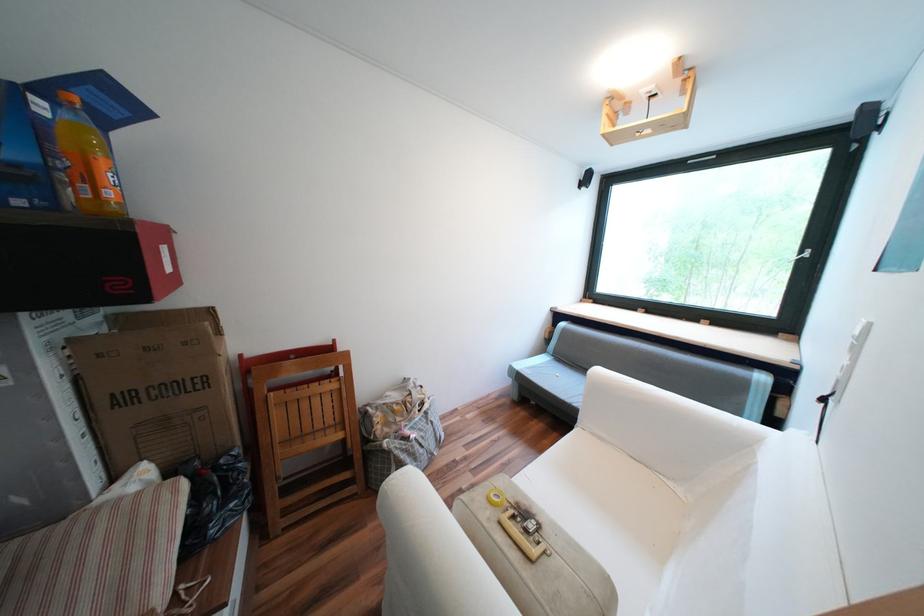
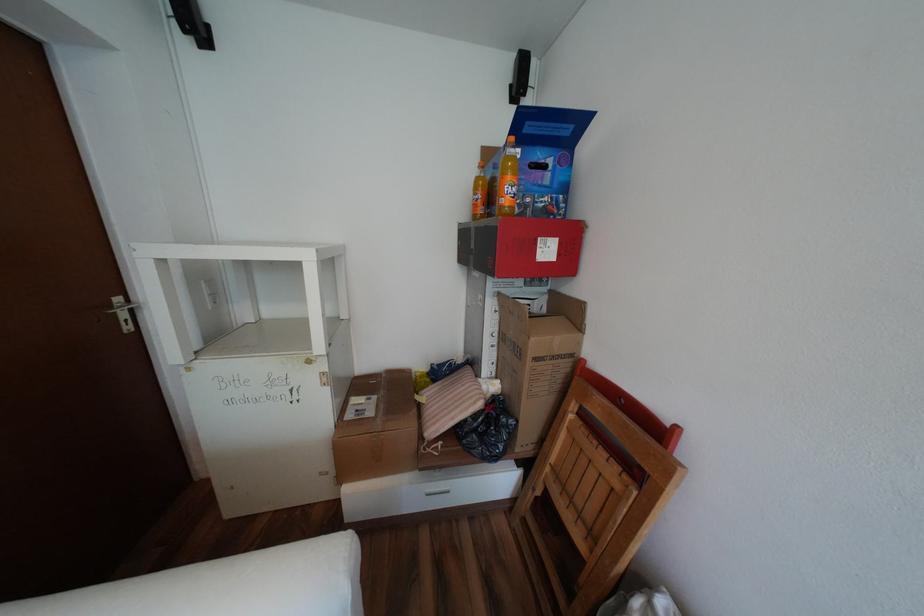
Find the pixel in the second image that matches [89,415] in the first image.

(505, 334)